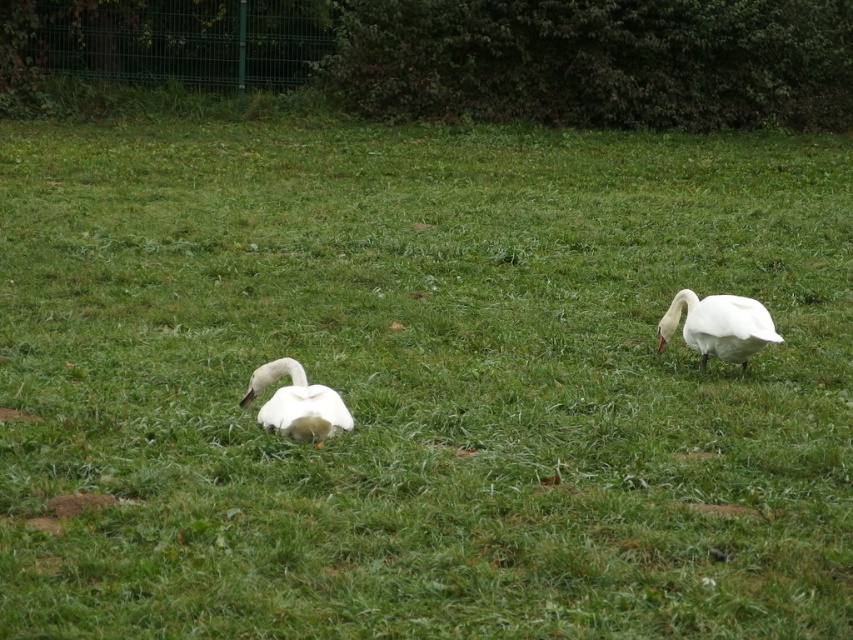
Is point (776, 339) closer to viewer compared to point (323, 401)?

No.

Which is behind, point (663, 326) or point (260, 406)?

Point (663, 326)

The image size is (853, 640). Identify the location of white matte swan at right. (718, 326).